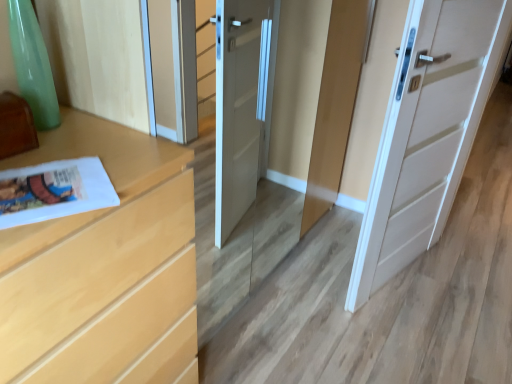
Question: Does light wood chest of drawers at left have a lesser width compared to white glossy magazine at lower left?

Choices:
 (A) no
 (B) yes

Answer: (A)

Question: Is light wood chest of drawers at left at the right side of white glossy magazine at lower left?

Choices:
 (A) yes
 (B) no

Answer: (B)

Question: From a real-world perspective, is light wood chest of drawers at left under white glossy magazine at lower left?

Choices:
 (A) yes
 (B) no

Answer: (A)

Question: Considering the relative sizes of light wood chest of drawers at left and white glossy magazine at lower left in the image provided, is light wood chest of drawers at left wider than white glossy magazine at lower left?

Choices:
 (A) yes
 (B) no

Answer: (A)

Question: From the image's perspective, does light wood chest of drawers at left appear lower than white glossy magazine at lower left?

Choices:
 (A) yes
 (B) no

Answer: (A)

Question: Is light wood chest of drawers at left spatially inside white matte door at center, or outside of it?

Choices:
 (A) outside
 (B) inside

Answer: (A)

Question: In terms of width, does light wood chest of drawers at left look wider or thinner when compared to white matte door at center?

Choices:
 (A) wide
 (B) thin

Answer: (A)

Question: From the image's perspective, relative to white matte door at center, is light wood chest of drawers at left above or below?

Choices:
 (A) above
 (B) below

Answer: (B)

Question: From a real-world perspective, is light wood chest of drawers at left above or below white matte door at center?

Choices:
 (A) above
 (B) below

Answer: (B)

Question: Do you think white glossy magazine at lower left is within white matte door at center, or outside of it?

Choices:
 (A) outside
 (B) inside

Answer: (A)

Question: From a real-world perspective, relative to white matte door at center, is white glossy magazine at lower left vertically above or below?

Choices:
 (A) above
 (B) below

Answer: (A)

Question: Considering the positions of white glossy magazine at lower left and white matte door at center in the image, is white glossy magazine at lower left wider or thinner than white matte door at center?

Choices:
 (A) thin
 (B) wide

Answer: (B)

Question: Considering their positions, is white glossy magazine at lower left located in front of or behind white matte door at center?

Choices:
 (A) front
 (B) behind

Answer: (A)

Question: Is white glossy magazine at lower left inside or outside of light wood chest of drawers at left?

Choices:
 (A) outside
 (B) inside

Answer: (B)

Question: Is white glossy magazine at lower left bigger or smaller than light wood chest of drawers at left?

Choices:
 (A) small
 (B) big

Answer: (A)